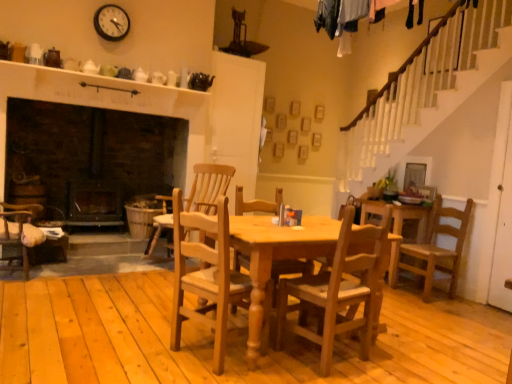
What do you see at coordinates (206, 275) in the screenshot?
I see `natural wood chair at center, marked as the third chair in a right-to-left arrangement` at bounding box center [206, 275].

What is the approximate width of natural wood chair at center, which is counted as the 1th chair, starting from the front?

It is 50.04 centimeters.

Find the location of a particular element. wooden chair at center, placed as the third chair when sorted from left to right is located at coordinates (341, 289).

Describe the element at coordinates (111, 22) in the screenshot. I see `black plastic clock at upper center` at that location.

The height and width of the screenshot is (384, 512). I want to click on natural wood chair at center, marked as the third chair in a right-to-left arrangement, so click(206, 275).

Is point (162, 202) closer or farther from the camera than point (362, 239)?

Clearly, point (162, 202) is more distant from the camera than point (362, 239).

Are light brown wood chair at center, which appears as the fourth chair when viewed from the right, and wooden chair at center, which appears as the 2th chair when viewed from the front, far apart?

Absolutely, light brown wood chair at center, which appears as the fourth chair when viewed from the right, is distant from wooden chair at center, which appears as the 2th chair when viewed from the front.

Is light brown wood chair at center, the first chair when ordered from left to right, not within wooden chair at center, which ranks as the 3th chair in back-to-front order?

Absolutely, light brown wood chair at center, the first chair when ordered from left to right, is external to wooden chair at center, which ranks as the 3th chair in back-to-front order.

Could you tell me if natural wood chair at center, marked as the 2th chair in a left-to-right arrangement, is facing wooden chair at center, placed as the third chair when sorted from left to right?

No, natural wood chair at center, marked as the 2th chair in a left-to-right arrangement, is not facing towards wooden chair at center, placed as the third chair when sorted from left to right.

From a real-world perspective, is natural wood chair at center, marked as the 2th chair in a left-to-right arrangement, over wooden chair at center, placed as the third chair when sorted from left to right?

Yes.

Is natural wood chair at center, the 4th chair when ordered from back to front, located outside wooden chair at center, the 2th chair when ordered from right to left?

Yes.

How far apart are black plastic clock at upper center and light brown wood chair at center, which appears as the fourth chair when viewed from the right?

1.82 meters.

Identify the location of clock on the left of light brown wood chair at center, which appears as the fourth chair when viewed from the right. The image size is (512, 384). (111, 22).

Is black plastic clock at upper center not near light brown wood chair at center, which appears as the fourth chair when viewed from the right?

Yes, black plastic clock at upper center is far from light brown wood chair at center, which appears as the fourth chair when viewed from the right.

Considering the relative positions of black plastic clock at upper center and light brown wood chair at center, arranged as the 1th chair when viewed from the back, in the image provided, is black plastic clock at upper center to the left of light brown wood chair at center, arranged as the 1th chair when viewed from the back, from the viewer's perspective?

Correct, you'll find black plastic clock at upper center to the left of light brown wood chair at center, arranged as the 1th chair when viewed from the back.

Does wooden chair at center, placed as the third chair when sorted from left to right, contain light brown wood chair at center, the first chair when ordered from left to right?

No, light brown wood chair at center, the first chair when ordered from left to right, is not inside wooden chair at center, placed as the third chair when sorted from left to right.

From a real-world perspective, between wooden chair at center, the 2th chair when ordered from right to left, and light brown wood chair at center, arranged as the 1th chair when viewed from the back, who is vertically higher?

light brown wood chair at center, arranged as the 1th chair when viewed from the back, from a real-world perspective.

Are wooden chair at center, placed as the third chair when sorted from left to right, and light brown wood chair at center, the first chair when ordered from left to right, making contact?

No, wooden chair at center, placed as the third chair when sorted from left to right, is not with light brown wood chair at center, the first chair when ordered from left to right.

Does wooden chair at center, which ranks as the 3th chair in back-to-front order, turn towards light brown wood chair at center, acting as the fourth chair starting from the front?

Yes, wooden chair at center, which ranks as the 3th chair in back-to-front order, is oriented towards light brown wood chair at center, acting as the fourth chair starting from the front.

How far apart are light brown wooden chair at right, acting as the 1th chair starting from the right, and light brown wood chair at center, acting as the fourth chair starting from the front?

A distance of 2.29 meters exists between light brown wooden chair at right, acting as the 1th chair starting from the right, and light brown wood chair at center, acting as the fourth chair starting from the front.

Considering the points (453, 267) and (153, 225), which point is in front, point (453, 267) or point (153, 225)?

The point (453, 267) is closer to the camera.

What's the angular difference between light brown wooden chair at right, the 3th chair viewed from the front, and light brown wood chair at center, acting as the fourth chair starting from the front,'s facing directions?

The angle between the facing direction of light brown wooden chair at right, the 3th chair viewed from the front, and the facing direction of light brown wood chair at center, acting as the fourth chair starting from the front, is 23.3 degrees.

Where is `chair behind the light brown wooden chair at right, the 3th chair viewed from the front`? chair behind the light brown wooden chair at right, the 3th chair viewed from the front is located at coordinates (208, 187).

Are light brown wood chair at center, arranged as the 1th chair when viewed from the back, and black plastic clock at upper center beside each other?

light brown wood chair at center, arranged as the 1th chair when viewed from the back, is not next to black plastic clock at upper center, and they're not touching.

From the image's perspective, is light brown wood chair at center, acting as the fourth chair starting from the front, above black plastic clock at upper center?

No.

Can you tell me how much light brown wood chair at center, which appears as the fourth chair when viewed from the right, and black plastic clock at upper center differ in facing direction?

The facing directions of light brown wood chair at center, which appears as the fourth chair when viewed from the right, and black plastic clock at upper center are 66.5 degrees apart.

Which is behind, point (449, 267) or point (321, 361)?

The point (449, 267) is behind.

Considering the positions of objects light brown wooden chair at right, acting as the 1th chair starting from the right, and wooden chair at center, the 2th chair when ordered from right to left, in the image provided, who is in front, light brown wooden chair at right, acting as the 1th chair starting from the right, or wooden chair at center, the 2th chair when ordered from right to left,?

wooden chair at center, the 2th chair when ordered from right to left.

Is light brown wooden chair at right, the second chair from the back, inside the boundaries of wooden chair at center, the 2th chair when ordered from right to left, or outside?

light brown wooden chair at right, the second chair from the back, is outside wooden chair at center, the 2th chair when ordered from right to left.

In order to click on chair on the right of the wooden chair at center, which ranks as the 3th chair in back-to-front order in this screenshot , I will do `click(438, 247)`.

From the image's perspective, which chair is the 3rd one below the light brown wood chair at center, which appears as the fourth chair when viewed from the right? Please provide its 2D coordinates.

[(341, 289)]

This screenshot has height=384, width=512. I want to click on chair lying in front of the wooden chair at center, which ranks as the 3th chair in back-to-front order, so click(206, 275).

Based on their spatial positions, is natural wood chair at center, the 4th chair when ordered from back to front, or light brown wood chair at center, arranged as the 1th chair when viewed from the back, closer to wooden chair at center, placed as the third chair when sorted from left to right?

The object closer to wooden chair at center, placed as the third chair when sorted from left to right, is natural wood chair at center, the 4th chair when ordered from back to front.

Which object lies further to the anchor point black plastic clock at upper center, light brown wooden chair at right, placed as the 4th chair when sorted from left to right, or light brown wood chair at center, which appears as the fourth chair when viewed from the right?

light brown wooden chair at right, placed as the 4th chair when sorted from left to right, is positioned further to the anchor black plastic clock at upper center.

Looking at the image, which one is located further to wooden chair at center, the 2th chair when ordered from right to left, black plastic clock at upper center or natural wood chair at center, marked as the 2th chair in a left-to-right arrangement?

black plastic clock at upper center.

From the image, which object appears to be farther from natural wood chair at center, marked as the third chair in a right-to-left arrangement, wooden chair at center, which ranks as the 3th chair in back-to-front order, or light brown wood chair at center, arranged as the 1th chair when viewed from the back?

light brown wood chair at center, arranged as the 1th chair when viewed from the back, is further to natural wood chair at center, marked as the third chair in a right-to-left arrangement.

When comparing their distances from light brown wood chair at center, arranged as the 1th chair when viewed from the back, does natural wood chair at center, the 4th chair when ordered from back to front, or light brown wooden chair at right, placed as the 4th chair when sorted from left to right, seem closer?

natural wood chair at center, the 4th chair when ordered from back to front, is positioned closer to the anchor light brown wood chair at center, arranged as the 1th chair when viewed from the back.

Considering their positions, is light brown wooden chair at right, placed as the 4th chair when sorted from left to right, positioned further to wooden chair at center, which ranks as the 3th chair in back-to-front order, than black plastic clock at upper center?

black plastic clock at upper center lies further to wooden chair at center, which ranks as the 3th chair in back-to-front order, than the other object.

Estimate the real-world distances between objects in this image. Which object is further from light brown wooden chair at right, the 3th chair viewed from the front, natural wood chair at center, the 4th chair when ordered from back to front, or wooden chair at center, which ranks as the 3th chair in back-to-front order?

Based on the image, natural wood chair at center, the 4th chair when ordered from back to front, appears to be further to light brown wooden chair at right, the 3th chair viewed from the front.

Looking at the image, which one is located further to light brown wooden chair at right, the 3th chair viewed from the front, natural wood chair at center, which is counted as the 1th chair, starting from the front, or black plastic clock at upper center?

black plastic clock at upper center.

You are a GUI agent. You are given a task and a screenshot of the screen. Output one action in this format:
    pyautogui.click(x=<x>, y=<y>)
    Task: Click on the chair between black plastic clock at upper center and natural wood chair at center, marked as the 2th chair in a left-to-right arrangement, in the up-down direction
    This screenshot has width=512, height=384.
    Given the screenshot: What is the action you would take?
    pyautogui.click(x=208, y=187)

Locate an element on the screen. chair situated between natural wood chair at center, the 4th chair when ordered from back to front, and light brown wooden chair at right, acting as the 1th chair starting from the right, from left to right is located at coordinates (341, 289).